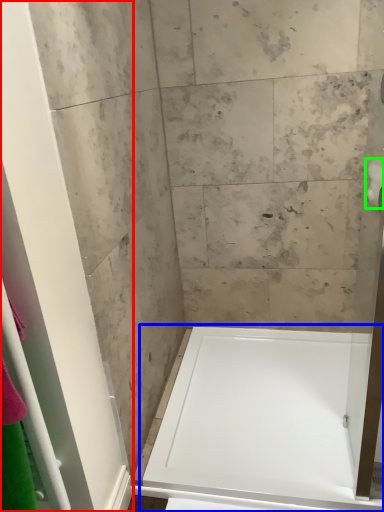
Question: Considering the real-world distances, which object is closest to screen door (highlighted by a red box)? bathtub (highlighted by a blue box) or toilet paper (highlighted by a green box).

Choices:
 (A) bathtub
 (B) toilet paper

Answer: (A)